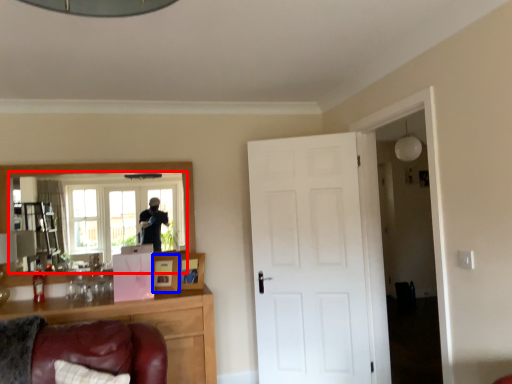
Question: Which object appears farthest to the camera in this image, mirror (highlighted by a red box) or picture frame (highlighted by a blue box)?

Choices:
 (A) mirror
 (B) picture frame

Answer: (B)